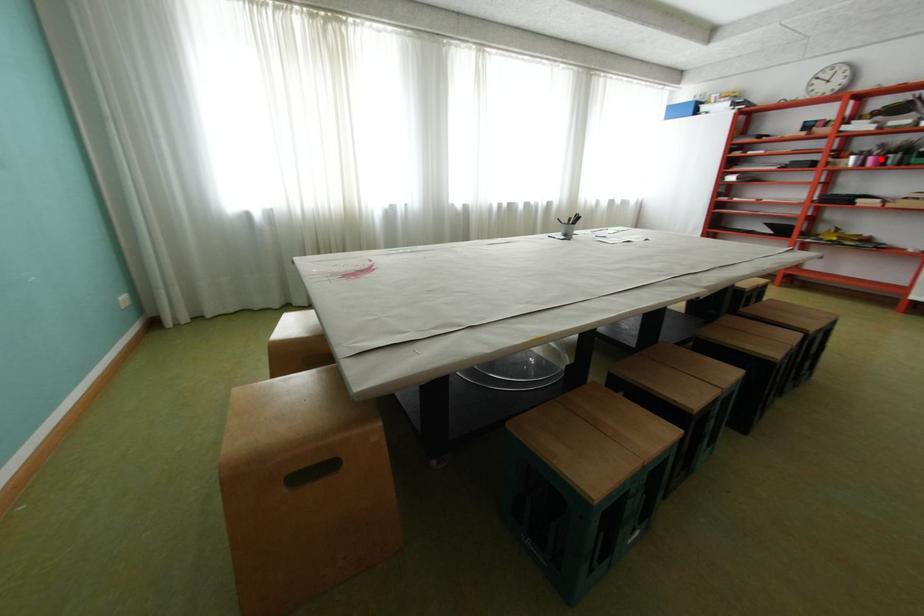
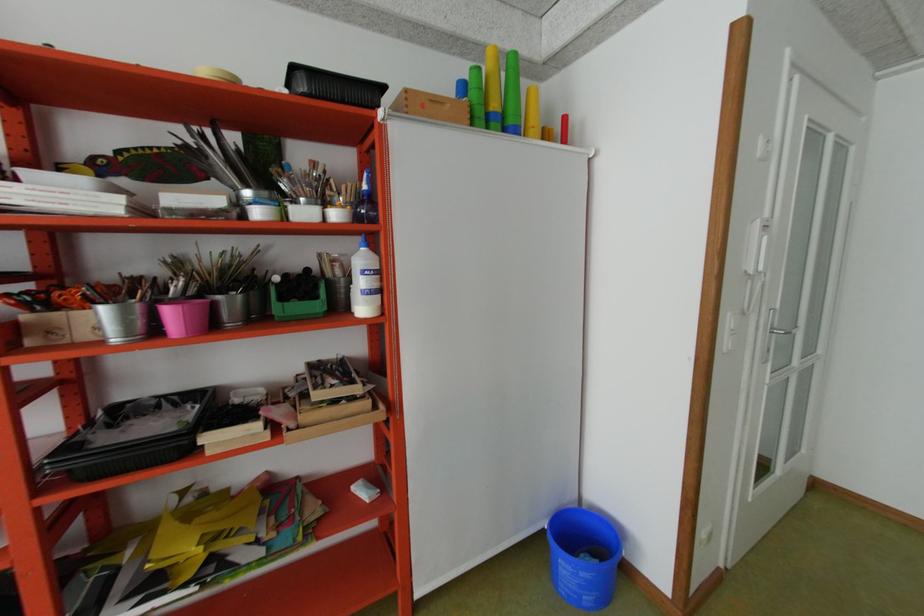
Find the pixel in the second image that matches the highlighted location in the first image.

(179, 313)